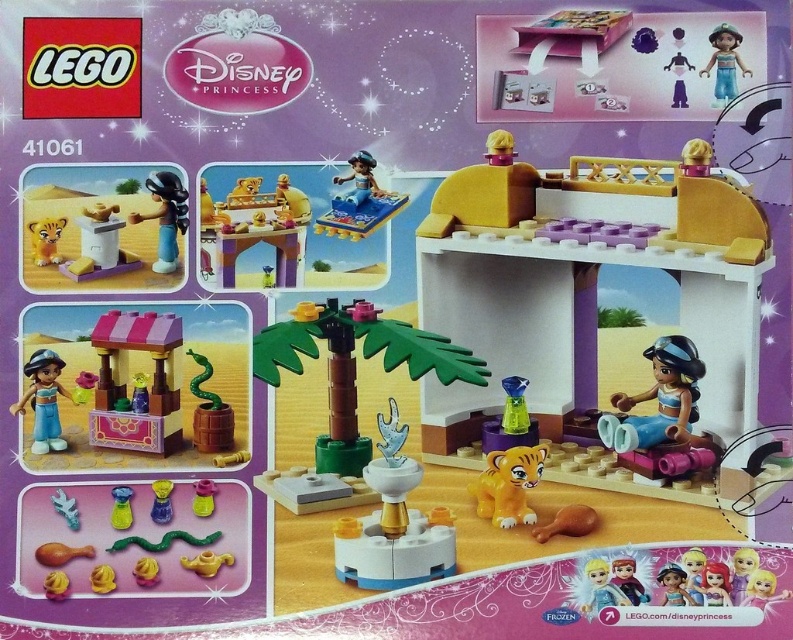
Question: Which point is closer to the camera taking this photo?

Choices:
 (A) (190, 349)
 (B) (717, 35)
 (C) (426, 547)

Answer: (C)

Question: Based on their relative distances, which object is farther from the smooth yellow table at upper center?

Choices:
 (A) matte blue figure at lower right
 (B) smooth yellow vase at lower left
 (C) pink glossy stall at lower left
 (D) green rubber snake at center

Answer: (A)

Question: Does smooth yellow table at upper center lie in front of green rubber snake at center?

Choices:
 (A) no
 (B) yes

Answer: (A)

Question: Which object is the farthest from the green matte palm tree at center?

Choices:
 (A) translucent yellow vase at lower left
 (B) smooth yellow toy at lower left
 (C) matte orange tiger at left
 (D) shiny blue mermaid at upper center

Answer: (B)

Question: Does translucent orange tiger at center have a smaller size compared to translucent yellow vase at lower left?

Choices:
 (A) yes
 (B) no

Answer: (B)

Question: Is matte blue carpet at upper center wider than smooth yellow candle at lower left?

Choices:
 (A) no
 (B) yes

Answer: (B)